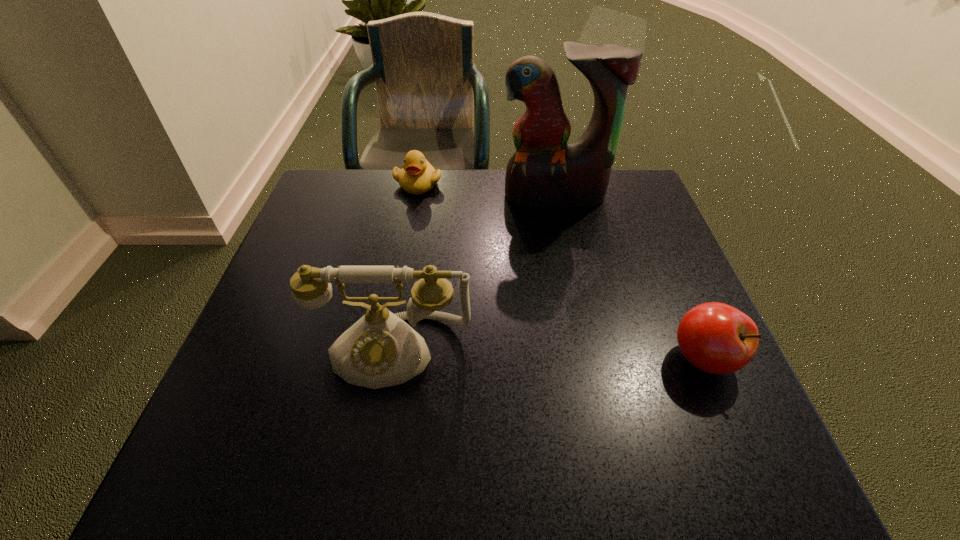
The width and height of the screenshot is (960, 540). What are the coordinates of `object at the near left corner` in the screenshot? It's located at (380, 350).

This screenshot has height=540, width=960. Find the location of `object that is positioned at the far right corner`. object that is positioned at the far right corner is located at coordinates (544, 172).

Find the location of a particular element. The image size is (960, 540). object present at the near right corner is located at coordinates (716, 338).

Locate an element on the screen. vacant space at the far edge is located at coordinates (383, 212).

Image resolution: width=960 pixels, height=540 pixels. In order to click on vacant space at the near edge of the desktop in this screenshot , I will do `click(509, 404)`.

Locate an element on the screen. Image resolution: width=960 pixels, height=540 pixels. vacant space at the left edge of the desktop is located at coordinates (347, 253).

Find the location of a particular element. The image size is (960, 540). free space at the right edge of the desktop is located at coordinates (630, 259).

In the image, there is a desktop. Where is `free region at the near left corner`? This screenshot has height=540, width=960. free region at the near left corner is located at coordinates (257, 378).

This screenshot has height=540, width=960. In the image, there is a desktop. Find the location of `vacant space at the far right corner`. vacant space at the far right corner is located at coordinates (641, 187).

This screenshot has height=540, width=960. In order to click on free spot between the rightmost object and the duckling in this screenshot , I will do `click(561, 271)`.